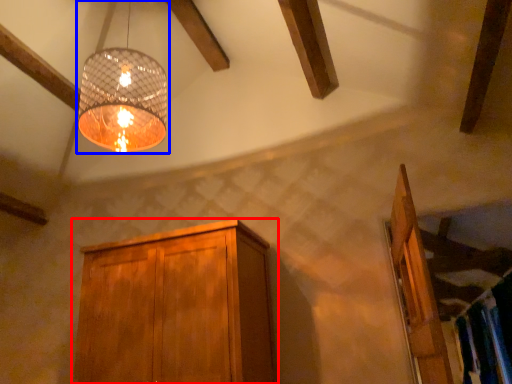
Question: Which point is further to the camera, cabinetry (highlighted by a red box) or lamp (highlighted by a blue box)?

Choices:
 (A) cabinetry
 (B) lamp

Answer: (A)